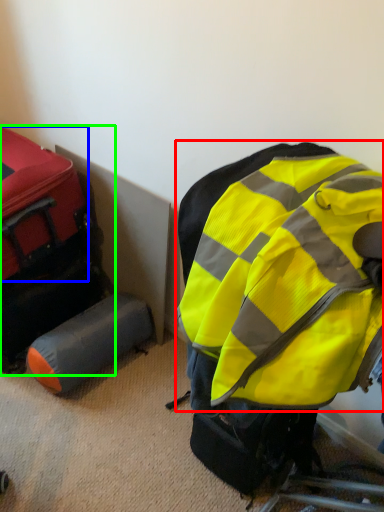
Question: Considering the real-world distances, which object is farthest from backpack (highlighted by a red box)? luggage (highlighted by a blue box) or luggage and bags (highlighted by a green box)?

Choices:
 (A) luggage
 (B) luggage and bags

Answer: (B)